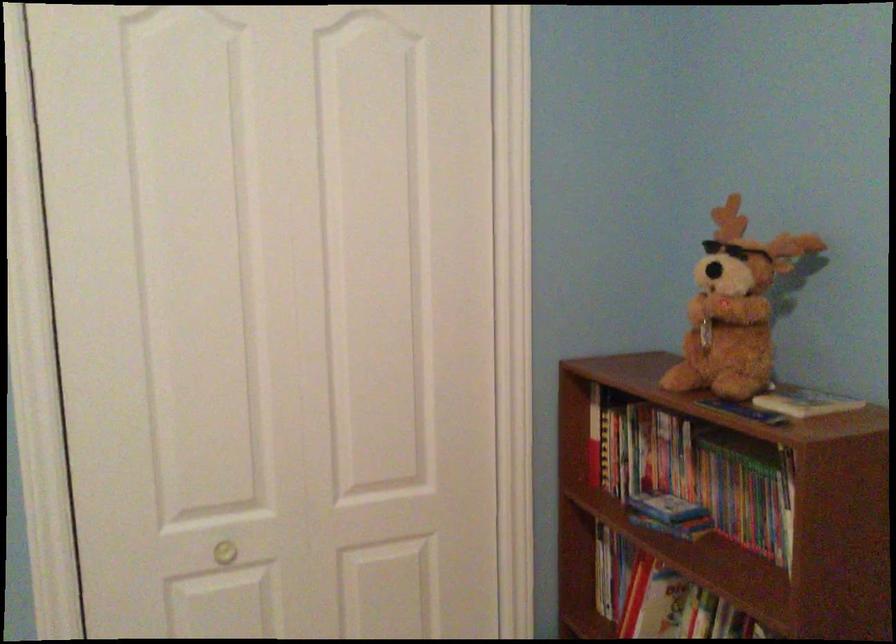
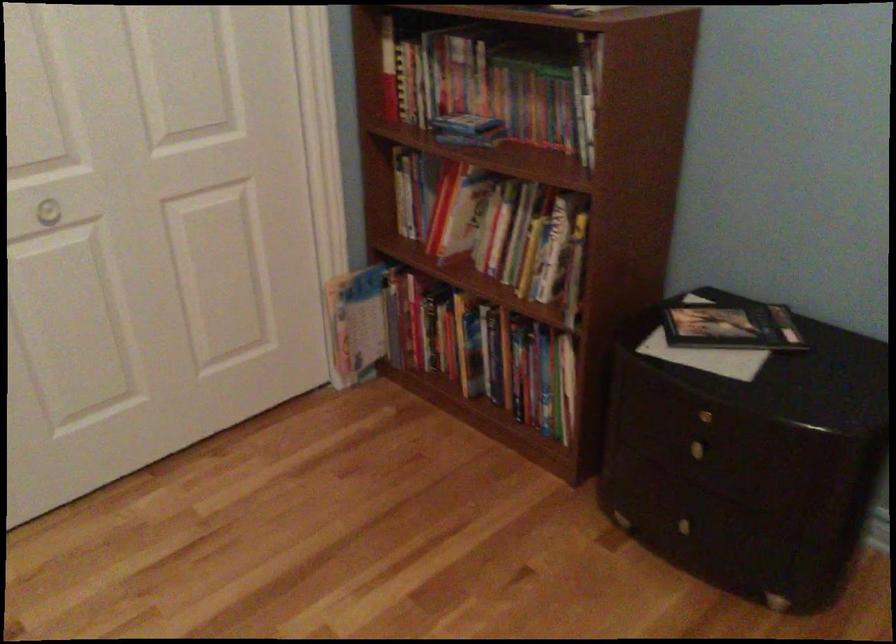
Locate, in the second image, the point that corresponds to the point at 604,450 in the first image.

(399, 84)